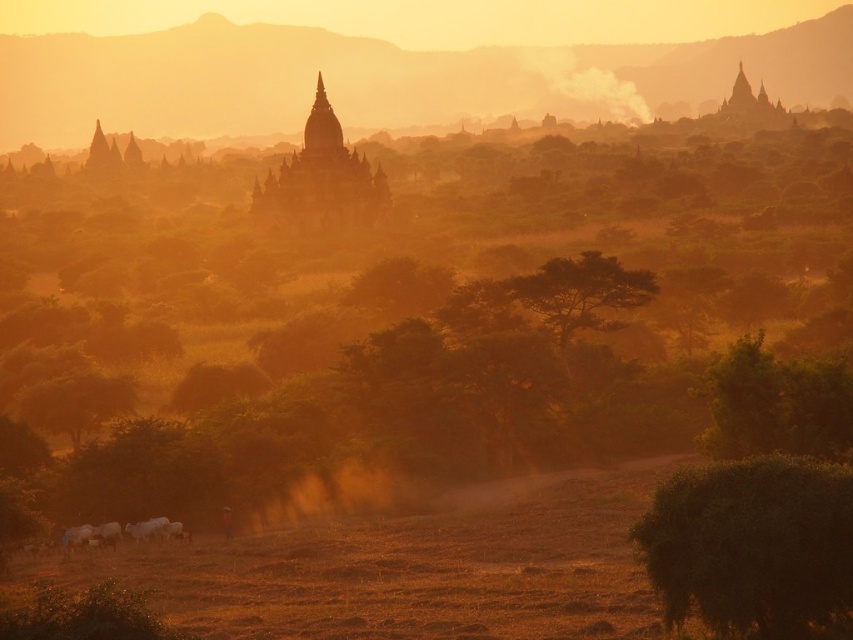
You are an artist sketching this landscape and want to add details to the foggy haze at upper center and the green leafy tree at center right. Which object should you draw first to maintain the correct spatial relationship?

You should draw the foggy haze at upper center first because it is closer to the viewer than the green leafy tree at center right, so it should be placed in front.

You are an artist trying to paint this landscape. You want to ensure the foggy haze at upper center and the green leafy tree at lower left are positioned correctly. Based on the scene description, which object should be placed higher in your painting?

The foggy haze at upper center should be placed higher than the green leafy tree at lower left because the foggy haze at upper center is above the green leafy tree at lower left in the scene.

You are an artist planning to paint this landscape. You want to emphasize the foggy haze at upper center and the green leafy tree at center right. Which of these two elements should you paint first if you follow the standard layering technique where closer objects are painted over distant ones?

The green leafy tree at center right should be painted first because it is closer to the viewer than the foggy haze at upper center, allowing the haze to be layered over it afterward.